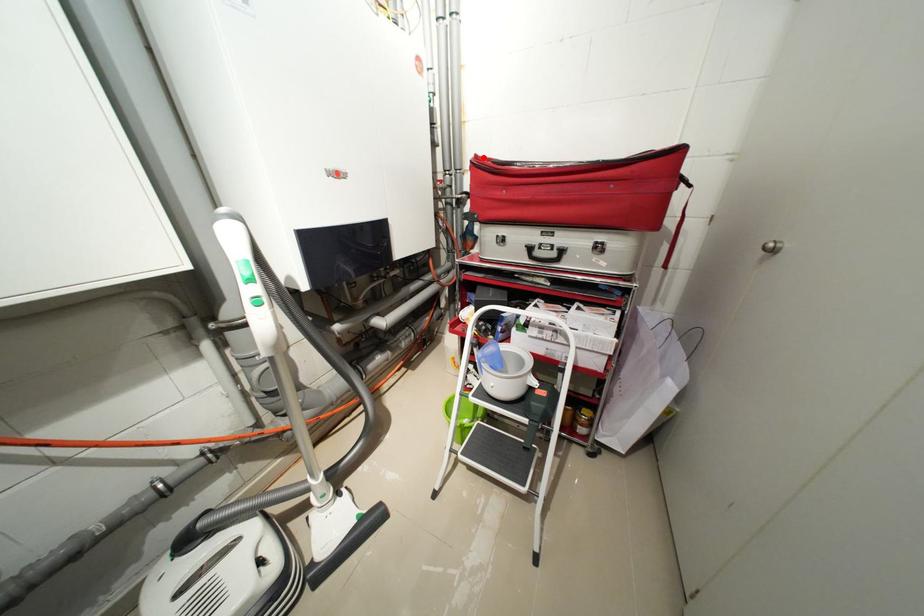
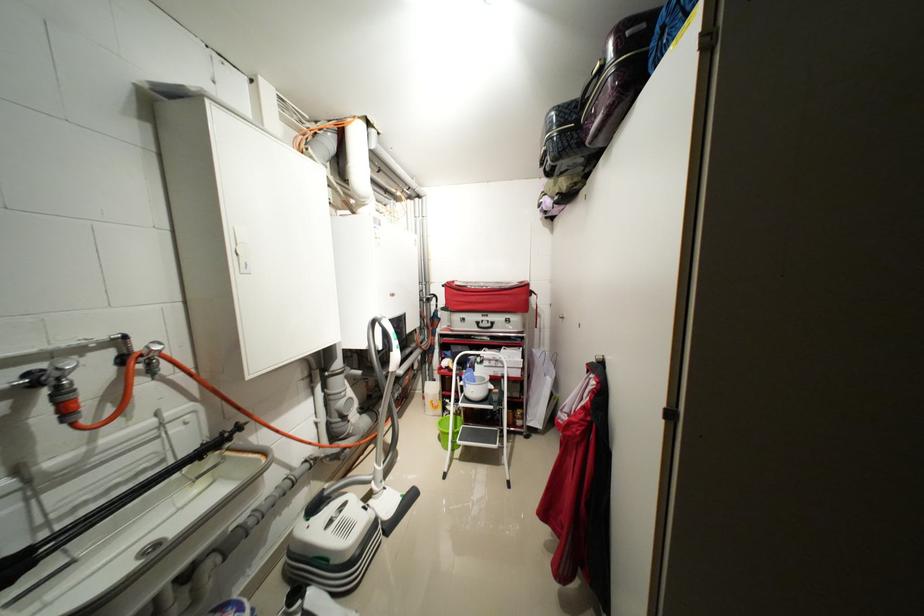
Where in the second image is the point corresponding to the highlighted location from the first image?

(455, 284)